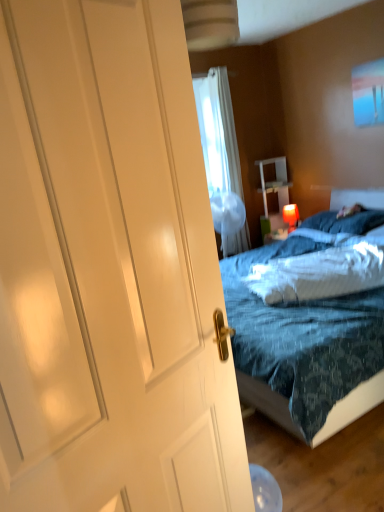
Locate an element on the screen. The width and height of the screenshot is (384, 512). blue soft pillow at center, which appears as the second pillow when ordered from the bottom is located at coordinates (345, 222).

What is the approximate height of matte red lampshade at upper right?

matte red lampshade at upper right is 11.89 inches in height.

Locate an element on the screen. The height and width of the screenshot is (512, 384). white sheer curtain at upper center is located at coordinates (225, 130).

What do you see at coordinates (274, 182) in the screenshot? The image size is (384, 512). I see `white glossy nightstand at center` at bounding box center [274, 182].

I want to click on blue soft pillow at center, which ranks as the 1th pillow in top-to-bottom order, so (x=345, y=222).

Is white sheer curtain at upper center taller or shorter than white glossy nightstand at center?

Considering their sizes, white sheer curtain at upper center has more height than white glossy nightstand at center.

From the image's perspective, which is above, white sheer curtain at upper center or white glossy nightstand at center?

white sheer curtain at upper center is shown above in the image.

Is white sheer curtain at upper center looking in the opposite direction of white glossy nightstand at center?

white sheer curtain at upper center does not have its back to white glossy nightstand at center.

Image resolution: width=384 pixels, height=512 pixels. In order to click on nightstand located behind the white sheer curtain at upper center in this screenshot , I will do `click(274, 182)`.

How many degrees apart are the facing directions of white fluffy pillow at center, arranged as the 2th pillow when viewed from the back, and blue soft pillow at center, which appears as the second pillow when ordered from the bottom?

The angular difference between white fluffy pillow at center, arranged as the 2th pillow when viewed from the back, and blue soft pillow at center, which appears as the second pillow when ordered from the bottom, is 29.6 degrees.

Locate an element on the screen. This screenshot has height=512, width=384. pillow behind the white fluffy pillow at center, placed as the 1th pillow when sorted from bottom to top is located at coordinates (345, 222).

From the image's perspective, is white fluffy pillow at center, the second pillow in the top-to-bottom sequence, beneath blue soft pillow at center, which ranks as the 1th pillow in top-to-bottom order?

Yes.

Is white fluffy pillow at center, placed as the 1th pillow when sorted from bottom to top, to the left of blue soft pillow at center, which ranks as the 1th pillow in top-to-bottom order, from the viewer's perspective?

Correct, you'll find white fluffy pillow at center, placed as the 1th pillow when sorted from bottom to top, to the left of blue soft pillow at center, which ranks as the 1th pillow in top-to-bottom order.

Is blue soft pillow at center, which is the first pillow in back-to-front order, smaller than white sheer curtain at upper center?

Yes, blue soft pillow at center, which is the first pillow in back-to-front order, is smaller than white sheer curtain at upper center.

From a real-world perspective, which pillow is the 2nd one underneath the white sheer curtain at upper center? Please provide its 2D coordinates.

[(345, 222)]

Would you say blue soft pillow at center, which appears as the second pillow when ordered from the bottom, is inside or outside white sheer curtain at upper center?

blue soft pillow at center, which appears as the second pillow when ordered from the bottom, cannot be found inside white sheer curtain at upper center.

Is blue soft pillow at center, which is the first pillow in back-to-front order, thinner than white sheer curtain at upper center?

No, blue soft pillow at center, which is the first pillow in back-to-front order, is not thinner than white sheer curtain at upper center.

Considering the positions of point (321, 298) and point (212, 103), is point (321, 298) closer or farther from the camera than point (212, 103)?

Clearly, point (321, 298) is closer to the camera than point (212, 103).

Can you confirm if white fluffy pillow at center, placed as the 1th pillow when sorted from bottom to top, is positioned to the left of white sheer curtain at upper center?

Incorrect, white fluffy pillow at center, placed as the 1th pillow when sorted from bottom to top, is not on the left side of white sheer curtain at upper center.

From a real-world perspective, does white fluffy pillow at center, placed as the 1th pillow when sorted from bottom to top, sit lower than white sheer curtain at upper center?

Yes, from a real-world perspective, white fluffy pillow at center, placed as the 1th pillow when sorted from bottom to top, is beneath white sheer curtain at upper center.

In the scene shown: Considering the sizes of objects white fluffy pillow at center, which is the first pillow from front to back, and white glossy door at left in the image provided, who is shorter, white fluffy pillow at center, which is the first pillow from front to back, or white glossy door at left?

white fluffy pillow at center, which is the first pillow from front to back, is shorter.

From a real-world perspective, does white fluffy pillow at center, which is the first pillow from front to back, stand above white glossy door at left?

No, from a real-world perspective, white fluffy pillow at center, which is the first pillow from front to back, is not above white glossy door at left.

Is white fluffy pillow at center, arranged as the 2th pillow when viewed from the back, not within white glossy door at left?

white fluffy pillow at center, arranged as the 2th pillow when viewed from the back, is positioned outside white glossy door at left.

From the image's perspective, is white fluffy pillow at center, placed as the 1th pillow when sorted from bottom to top, over white glossy door at left?

Yes, from the image's perspective, white fluffy pillow at center, placed as the 1th pillow when sorted from bottom to top, is above white glossy door at left.

Considering the points (280, 205) and (309, 227), which point is in front, point (280, 205) or point (309, 227)?

The point (309, 227) is closer.

Between white glossy nightstand at center and blue soft pillow at center, which is the 2th pillow from front to back, which one has larger width?

With larger width is blue soft pillow at center, which is the 2th pillow from front to back.

Is blue soft pillow at center, which is the first pillow in back-to-front order, inside white glossy nightstand at center?

No, blue soft pillow at center, which is the first pillow in back-to-front order, is not inside white glossy nightstand at center.

Is white glossy nightstand at center at the left side of blue soft pillow at center, which ranks as the 1th pillow in top-to-bottom order?

Indeed, white glossy nightstand at center is positioned on the left side of blue soft pillow at center, which ranks as the 1th pillow in top-to-bottom order.

From a real-world perspective, which is physically below, white glossy door at left or white sheer curtain at upper center?

In real-world perspective, white glossy door at left is lower.

In the scene shown: Which is more to the right, white glossy door at left or white sheer curtain at upper center?

white sheer curtain at upper center is more to the right.

Is white glossy door at left aimed at white sheer curtain at upper center?

No, white glossy door at left is not turned towards white sheer curtain at upper center.

Between white glossy door at left and white sheer curtain at upper center, which one is positioned behind?

white sheer curtain at upper center.

Identify the location of curtain in front of the white glossy nightstand at center. The height and width of the screenshot is (512, 384). (225, 130).

You are a GUI agent. You are given a task and a screenshot of the screen. Output one action in this format:
    pyautogui.click(x=<x>, y=<y>)
    Task: Click on the pillow above the blue soft pillow at center, which is the first pillow in back-to-front order (from a real-world perspective)
    This screenshot has height=512, width=384.
    Given the screenshot: What is the action you would take?
    pyautogui.click(x=320, y=273)

Estimate the real-world distances between objects in this image. Which object is further from blue soft pillow at center, which ranks as the 1th pillow in top-to-bottom order, matte red lampshade at upper right or white glossy door at left?

The object further to blue soft pillow at center, which ranks as the 1th pillow in top-to-bottom order, is white glossy door at left.

Based on their spatial positions, is blue soft pillow at center, which appears as the second pillow when ordered from the bottom, or white fluffy pillow at center, the second pillow in the top-to-bottom sequence, further from white glossy nightstand at center?

Based on the image, white fluffy pillow at center, the second pillow in the top-to-bottom sequence, appears to be further to white glossy nightstand at center.

Considering their positions, is white fluffy pillow at center, the second pillow in the top-to-bottom sequence, positioned further to blue soft pillow at center, which appears as the second pillow when ordered from the bottom, than white glossy door at left?

Based on the image, white glossy door at left appears to be further to blue soft pillow at center, which appears as the second pillow when ordered from the bottom.

Estimate the real-world distances between objects in this image. Which object is further from white glossy door at left, white sheer curtain at upper center or blue soft pillow at center, which appears as the second pillow when ordered from the bottom?

white sheer curtain at upper center is positioned further to the anchor white glossy door at left.

Which object lies further to the anchor point blue soft pillow at center, which is the 2th pillow from front to back, white fluffy pillow at center, arranged as the 2th pillow when viewed from the back, or matte red lampshade at upper right?

white fluffy pillow at center, arranged as the 2th pillow when viewed from the back, lies further to blue soft pillow at center, which is the 2th pillow from front to back, than the other object.

Considering their positions, is white sheer curtain at upper center positioned further to white glossy door at left than matte red lampshade at upper right?

Based on the image, white sheer curtain at upper center appears to be further to white glossy door at left.

From the image, which object appears to be nearer to white glossy door at left, white fluffy pillow at center, which is the first pillow from front to back, or white glossy nightstand at center?

white fluffy pillow at center, which is the first pillow from front to back, lies closer to white glossy door at left than the other object.

Based on their spatial positions, is white glossy nightstand at center or matte red lampshade at upper right closer to white fluffy pillow at center, the second pillow in the top-to-bottom sequence?

The object closer to white fluffy pillow at center, the second pillow in the top-to-bottom sequence, is matte red lampshade at upper right.

Locate an element on the screen. This screenshot has height=512, width=384. lamp between white fluffy pillow at center, which is the first pillow from front to back, and white glossy nightstand at center from front to back is located at coordinates (291, 216).

You are a GUI agent. You are given a task and a screenshot of the screen. Output one action in this format:
    pyautogui.click(x=<x>, y=<y>)
    Task: Click on the lamp between white glossy door at left and white glossy nightstand at center from front to back
    
    Given the screenshot: What is the action you would take?
    pyautogui.click(x=291, y=216)

Where is `curtain between white fluffy pillow at center, placed as the 1th pillow when sorted from bottom to top, and white glossy nightstand at center, along the z-axis`? curtain between white fluffy pillow at center, placed as the 1th pillow when sorted from bottom to top, and white glossy nightstand at center, along the z-axis is located at coordinates (225, 130).

I want to click on curtain positioned between white glossy door at left and matte red lampshade at upper right from near to far, so pyautogui.click(x=225, y=130).